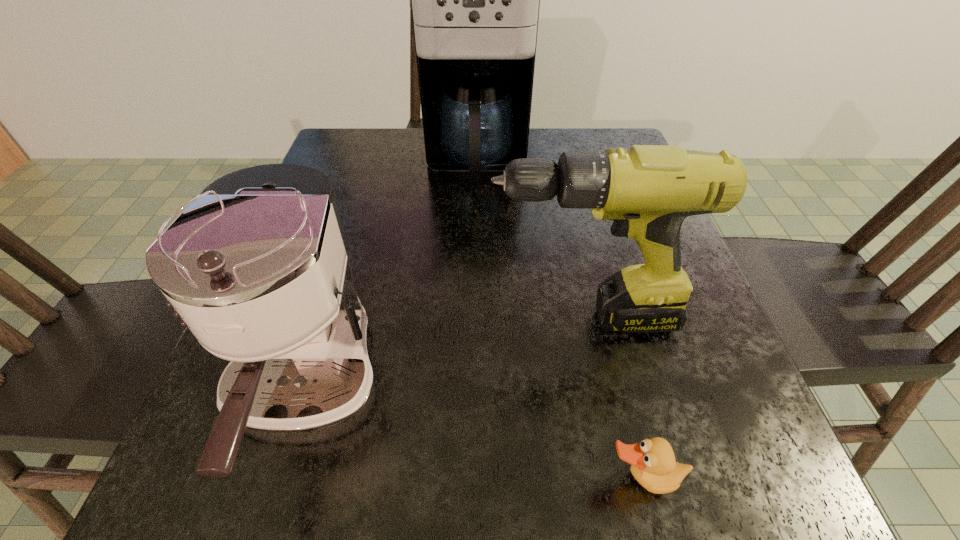
Find the location of a particular element. free point at the left edge is located at coordinates (379, 199).

Image resolution: width=960 pixels, height=540 pixels. In order to click on vacant space at the right edge in this screenshot , I will do `click(687, 399)`.

Find the location of a particular element. This screenshot has width=960, height=540. vacant space at the far right corner of the desktop is located at coordinates (618, 133).

This screenshot has height=540, width=960. Find the location of `vacant space that's between the leftmost object and the drill`. vacant space that's between the leftmost object and the drill is located at coordinates (444, 354).

Where is `vacant region between the shortest object and the leftmost object`? vacant region between the shortest object and the leftmost object is located at coordinates pyautogui.click(x=474, y=435).

At what (x,y) coordinates should I click in order to perform the action: click on free point between the leftmost object and the drill. Please return your answer as a coordinate pair (x, y). This screenshot has height=540, width=960. Looking at the image, I should click on (444, 354).

Where is `unoccupied position between the farther coffee maker and the duck`? The width and height of the screenshot is (960, 540). unoccupied position between the farther coffee maker and the duck is located at coordinates (560, 322).

The width and height of the screenshot is (960, 540). Find the location of `empty space that is in between the shortest object and the farthest object`. empty space that is in between the shortest object and the farthest object is located at coordinates (560, 322).

Where is `free space between the nearer coffee maker and the drill`? The height and width of the screenshot is (540, 960). free space between the nearer coffee maker and the drill is located at coordinates (444, 354).

Locate an element on the screen. The image size is (960, 540). free space between the farther coffee maker and the drill is located at coordinates (529, 241).